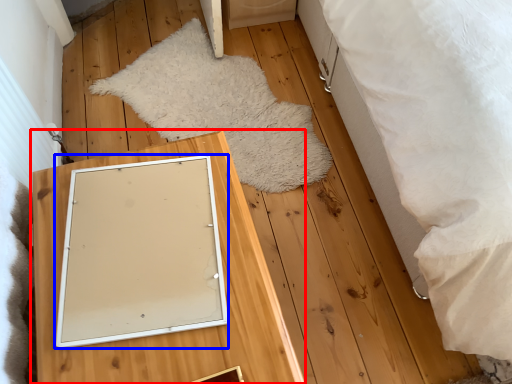
Question: Which object is closer to the camera taking this photo, furniture (highlighted by a red box) or picture frame (highlighted by a blue box)?

Choices:
 (A) furniture
 (B) picture frame

Answer: (A)